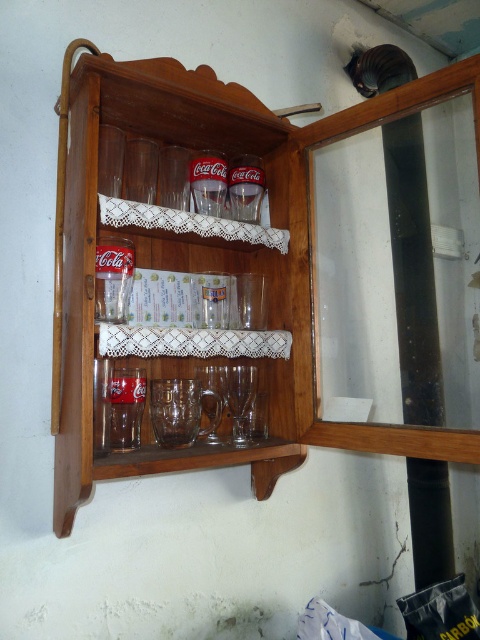
This screenshot has height=640, width=480. I want to click on wooden cabinet at center, so click(166, 257).

At what (x,y) coordinates should I click in order to perform the action: click on wooden cabinet at center. Please return your answer as a coordinate pair (x, y). Looking at the image, I should click on (166, 257).

This screenshot has height=640, width=480. In order to click on wooden cabinet at center in this screenshot , I will do `click(166, 257)`.